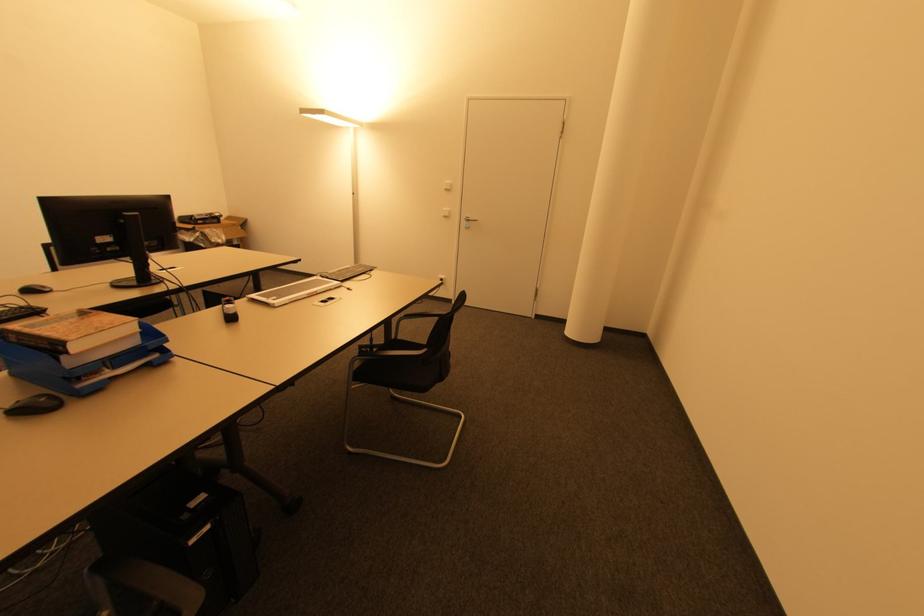
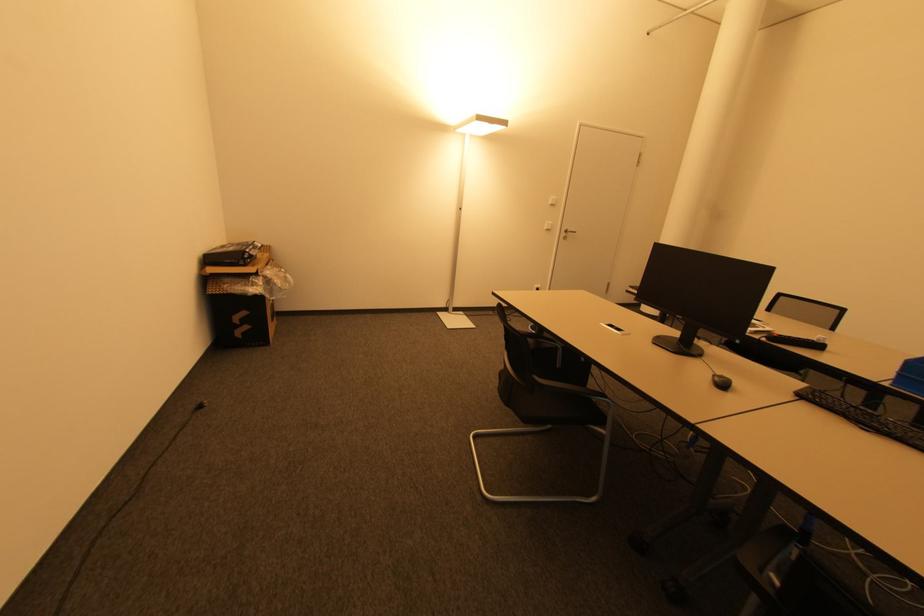
The point at (x=33, y=292) is marked in the first image. Where is the corresponding point in the second image?

(725, 386)